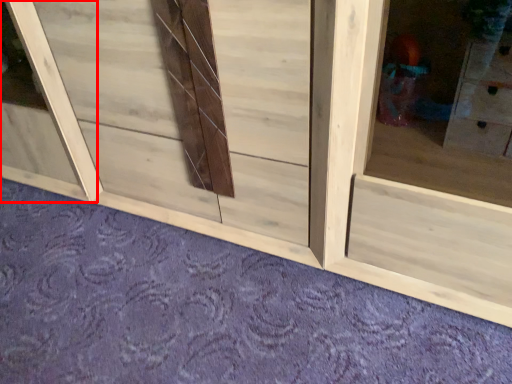
Question: From the image's perspective, what is the correct spatial positioning of window frame (annotated by the red box) in reference to plain?

Choices:
 (A) below
 (B) above

Answer: (B)